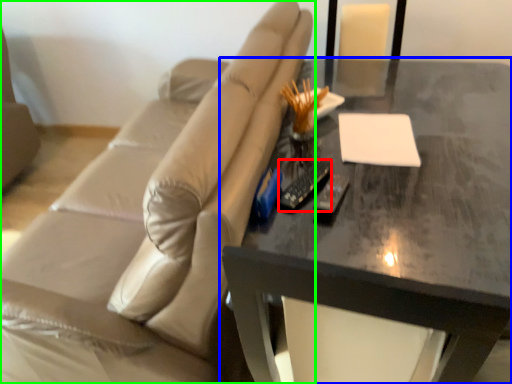
Question: Based on their relative distances, which object is farther from remote (highlighted by a red box)? Choose from table (highlighted by a blue box) and studio couch (highlighted by a green box).

Choices:
 (A) table
 (B) studio couch

Answer: (B)